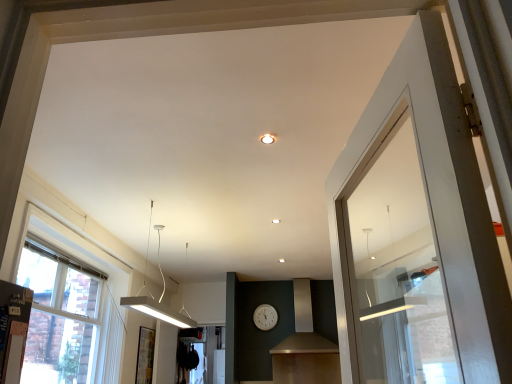
What do you see at coordinates (68, 305) in the screenshot? I see `white wood window at left` at bounding box center [68, 305].

Measure the distance between point (271, 324) and camera.

A distance of 20.00 feet exists between point (271, 324) and camera.

The width and height of the screenshot is (512, 384). Describe the element at coordinates (265, 317) in the screenshot. I see `white plastic clock at center` at that location.

The height and width of the screenshot is (384, 512). Describe the element at coordinates (267, 138) in the screenshot. I see `matte white ceiling light at center` at that location.

In order to click on white wood window at left in this screenshot , I will do `click(68, 305)`.

In order to click on vent below the white matte rectangular light fixture at left (from a real-world perspective) in this screenshot , I will do `click(324, 309)`.

From a real-world perspective, is matte black vent at center above or below white matte rectangular light fixture at left?

matte black vent at center is situated lower than white matte rectangular light fixture at left in the real world.

What's the angular difference between matte black vent at center and white matte rectangular light fixture at left's facing directions?

The angle between the facing direction of matte black vent at center and the facing direction of white matte rectangular light fixture at left is 180 degrees.

Is matte black vent at center positioned behind white matte rectangular light fixture at left?

Yes, it is.

Which object is further away from the camera taking this photo, white matte rectangular light fixture at left or white plastic clock at center?

white plastic clock at center is more distant.

How different are the orientations of white matte rectangular light fixture at left and white plastic clock at center in degrees?

The angle between the facing direction of white matte rectangular light fixture at left and the facing direction of white plastic clock at center is 180 degrees.

Looking at this image, in terms of width, does white matte rectangular light fixture at left look wider or thinner when compared to white plastic clock at center?

Considering their sizes, white matte rectangular light fixture at left looks broader than white plastic clock at center.

I want to click on light fixture in front of the white plastic clock at center, so click(159, 298).

Identify the location of clock located underneath the matte white ceiling light at center (from a real-world perspective). (265, 317).

Which object is more forward, matte white ceiling light at center or white plastic clock at center?

matte white ceiling light at center.

Is matte white ceiling light at center facing towards white plastic clock at center?

Yes, matte white ceiling light at center faces towards white plastic clock at center.

Does matte white ceiling light at center have a greater width compared to white plastic clock at center?

No.

Can you confirm if matte black vent at center is smaller than matte white ceiling light at center?

No, matte black vent at center is not smaller than matte white ceiling light at center.

Where is `lighting above the matte black vent at center (from a real-world perspective)`? lighting above the matte black vent at center (from a real-world perspective) is located at coordinates (267, 138).

From the image's perspective, which one is positioned lower, matte black vent at center or matte white ceiling light at center?

matte black vent at center appears lower in the image.

Is matte black vent at center not near matte white ceiling light at center?

That's right, there is a large distance between matte black vent at center and matte white ceiling light at center.

How many degrees apart are the facing directions of matte white ceiling light at center and matte black vent at center?

There is a 180-degree angle between the facing directions of matte white ceiling light at center and matte black vent at center.

Considering the sizes of objects matte white ceiling light at center and matte black vent at center in the image provided, who is smaller, matte white ceiling light at center or matte black vent at center?

With smaller size is matte white ceiling light at center.

From the picture: Is matte white ceiling light at center aimed at matte black vent at center?

Yes, matte white ceiling light at center is facing matte black vent at center.

Visually, is matte white ceiling light at center positioned to the left or to the right of white matte rectangular light fixture at left?

Clearly, matte white ceiling light at center is on the right of white matte rectangular light fixture at left in the image.

Considering their positions, is matte white ceiling light at center located in front of or behind white matte rectangular light fixture at left?

matte white ceiling light at center is positioned closer to the viewer than white matte rectangular light fixture at left.

Is matte white ceiling light at center taller or shorter than white matte rectangular light fixture at left?

In the image, matte white ceiling light at center appears to be shorter than white matte rectangular light fixture at left.

Looking at this image, between matte white ceiling light at center and white matte rectangular light fixture at left, which one has larger width?

white matte rectangular light fixture at left.

Would you say matte white ceiling light at center is part of white matte rectangular light fixture at left's contents?

No, matte white ceiling light at center is not a part of white matte rectangular light fixture at left.

Is white matte rectangular light fixture at left positioned far away from matte white ceiling light at center?

Yes, white matte rectangular light fixture at left and matte white ceiling light at center are quite far apart.

From the picture: Is white matte rectangular light fixture at left looking in the opposite direction of matte white ceiling light at center?

No, white matte rectangular light fixture at left is not facing away from matte white ceiling light at center.

From the image's perspective, is white matte rectangular light fixture at left under matte white ceiling light at center?

Indeed, from the image's perspective, white matte rectangular light fixture at left is shown beneath matte white ceiling light at center.

The image size is (512, 384). Find the location of `vent on the right side of white matte rectangular light fixture at left`. vent on the right side of white matte rectangular light fixture at left is located at coordinates (324, 309).

You are a GUI agent. You are given a task and a screenshot of the screen. Output one action in this format:
    pyautogui.click(x=<x>, y=<y>)
    Task: Click on the clock located behind the white matte rectangular light fixture at left
    
    Given the screenshot: What is the action you would take?
    pyautogui.click(x=265, y=317)

From the image, which object appears to be nearer to white plastic clock at center, matte black vent at center or white wood window at left?

The object closer to white plastic clock at center is matte black vent at center.

Estimate the real-world distances between objects in this image. Which object is further from white plastic clock at center, matte white ceiling light at center or white wood window at left?

Based on the image, matte white ceiling light at center appears to be further to white plastic clock at center.

Based on the photo, estimate the real-world distances between objects in this image. Which object is further from white plastic clock at center, matte black vent at center or white matte rectangular light fixture at left?

white matte rectangular light fixture at left is further to white plastic clock at center.

Based on the photo, estimate the real-world distances between objects in this image. Which object is closer to white matte rectangular light fixture at left, matte white ceiling light at center or white wood window at left?

white wood window at left.

Which object lies further to the anchor point matte white ceiling light at center, white matte rectangular light fixture at left or white plastic clock at center?

The object further to matte white ceiling light at center is white plastic clock at center.

Considering their positions, is matte white ceiling light at center positioned further to white plastic clock at center than white matte rectangular light fixture at left?

matte white ceiling light at center.

Based on their spatial positions, is white plastic clock at center or white wood window at left closer to matte black vent at center?

white plastic clock at center is positioned closer to the anchor matte black vent at center.

Looking at the image, which one is located closer to white plastic clock at center, white wood window at left or white matte rectangular light fixture at left?

white matte rectangular light fixture at left.

Identify the location of vent between white wood window at left and white plastic clock at center from front to back. The image size is (512, 384). (324, 309).

The width and height of the screenshot is (512, 384). I want to click on light fixture between white wood window at left and matte white ceiling light at center from left to right, so click(x=159, y=298).

This screenshot has height=384, width=512. Find the location of `vent positioned between matte white ceiling light at center and white plastic clock at center from near to far`. vent positioned between matte white ceiling light at center and white plastic clock at center from near to far is located at coordinates (324, 309).

Locate an element on the screen. The height and width of the screenshot is (384, 512). light fixture between matte white ceiling light at center and matte black vent at center along the z-axis is located at coordinates (159, 298).